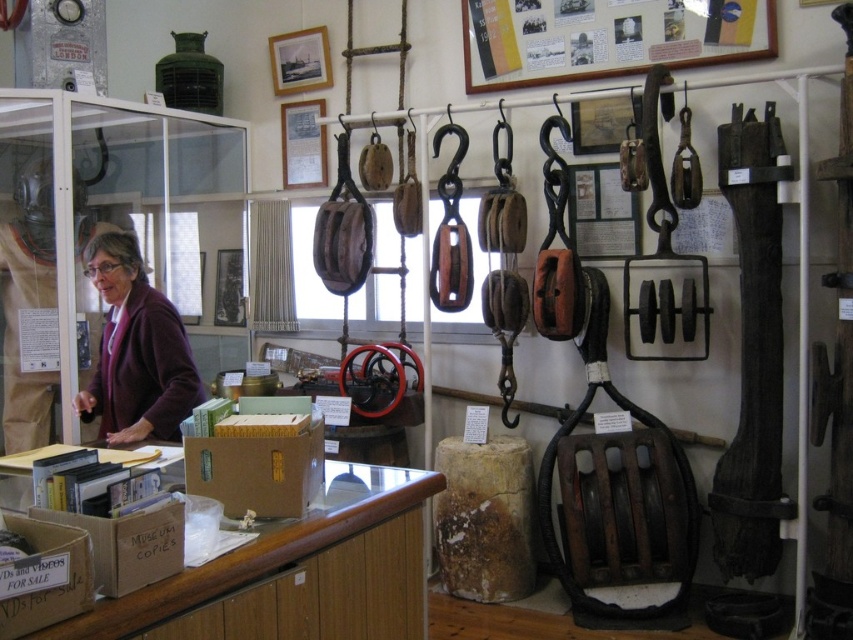
Question: Which point appears farthest from the camera in this image?

Choices:
 (A) (737, 40)
 (B) (114, 422)

Answer: (A)

Question: Observing the image, what is the correct spatial positioning of wooden frame at upper center in reference to matte purple sweater at left?

Choices:
 (A) above
 (B) below

Answer: (A)

Question: Does wooden frame at upper center have a lesser width compared to matte purple sweater at left?

Choices:
 (A) yes
 (B) no

Answer: (B)

Question: Which object is closer to the camera taking this photo?

Choices:
 (A) wooden frame at upper center
 (B) matte purple sweater at left

Answer: (B)

Question: Which object is closer to the camera taking this photo?

Choices:
 (A) wooden frame at upper center
 (B) matte purple sweater at left

Answer: (B)

Question: Does wooden frame at upper center appear under matte purple sweater at left?

Choices:
 (A) no
 (B) yes

Answer: (A)